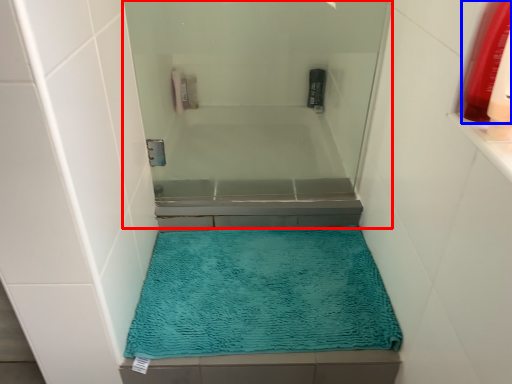
Question: Among these objects, which one is farthest to the camera, screen door (highlighted by a red box) or mouthwash (highlighted by a blue box)?

Choices:
 (A) screen door
 (B) mouthwash

Answer: (A)